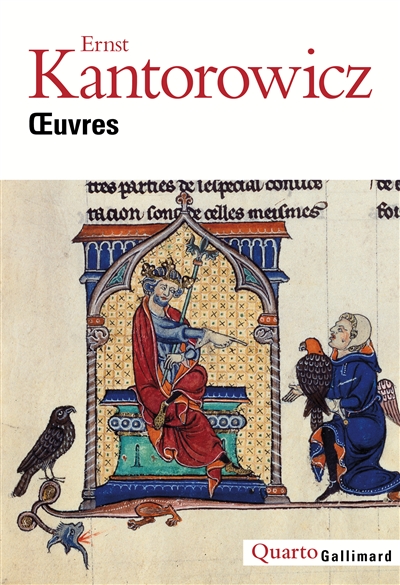
Identify the location of chair. (220, 390).